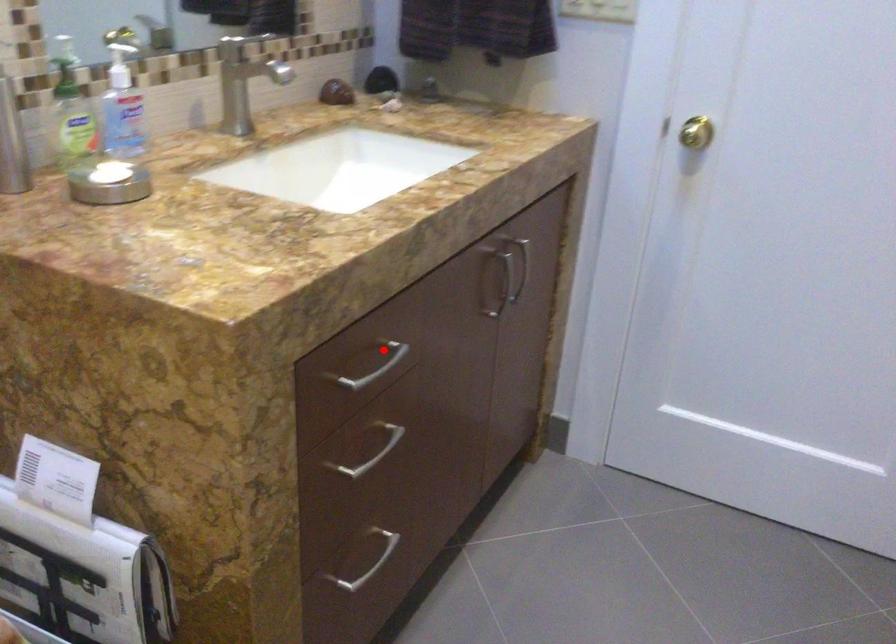
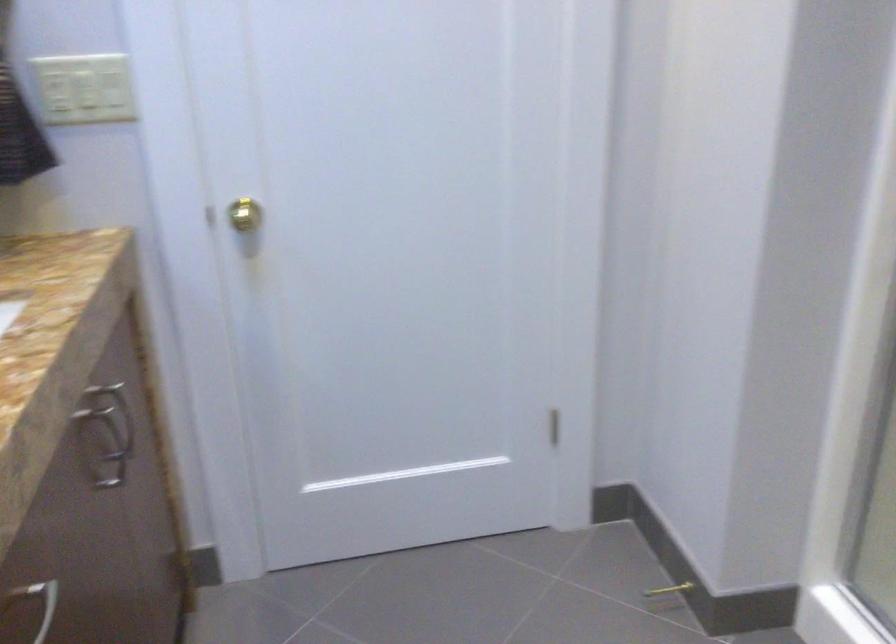
The point at the highlighted location is marked in the first image. Where is the corresponding point in the second image?

(37, 603)